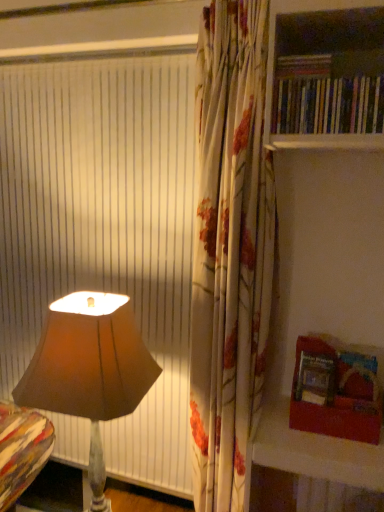
Question: From the image's perspective, is wooden bookshelf at right on hardcover book at upper right, acting as the second book starting from the bottom?

Choices:
 (A) no
 (B) yes

Answer: (A)

Question: From a real-world perspective, is wooden bookshelf at right below hardcover book at upper right, acting as the second book starting from the bottom?

Choices:
 (A) no
 (B) yes

Answer: (B)

Question: Is wooden bookshelf at right positioned behind hardcover book at upper right, which ranks as the first book in top-to-bottom order?

Choices:
 (A) no
 (B) yes

Answer: (A)

Question: Is wooden bookshelf at right positioned with its back to hardcover book at upper right, which ranks as the first book in top-to-bottom order?

Choices:
 (A) no
 (B) yes

Answer: (B)

Question: Does wooden bookshelf at right have a greater width compared to hardcover book at upper right, acting as the second book starting from the bottom?

Choices:
 (A) yes
 (B) no

Answer: (A)

Question: Does wooden bookshelf at right have a greater height compared to hardcover book at upper right, which ranks as the first book in top-to-bottom order?

Choices:
 (A) yes
 (B) no

Answer: (A)

Question: Is the depth of hardcover books at upper right, acting as the 2th book starting from the top, less than that of hardcover book at upper right, acting as the second book starting from the bottom?

Choices:
 (A) yes
 (B) no

Answer: (A)

Question: Is hardcover books at upper right, acting as the 2th book starting from the top, to the right of hardcover book at upper right, acting as the second book starting from the bottom, from the viewer's perspective?

Choices:
 (A) yes
 (B) no

Answer: (A)

Question: Is hardcover books at upper right, which ranks as the 1th book in bottom-to-top order, oriented away from hardcover book at upper right, acting as the second book starting from the bottom?

Choices:
 (A) no
 (B) yes

Answer: (A)

Question: Is hardcover book at upper right, which ranks as the first book in top-to-bottom order, a part of hardcover books at upper right, acting as the 2th book starting from the top?

Choices:
 (A) yes
 (B) no

Answer: (B)

Question: From a real-world perspective, does hardcover books at upper right, acting as the 2th book starting from the top, stand above hardcover book at upper right, which ranks as the first book in top-to-bottom order?

Choices:
 (A) no
 (B) yes

Answer: (A)

Question: Is hardcover books at upper right, acting as the 2th book starting from the top, smaller than hardcover book at upper right, which ranks as the first book in top-to-bottom order?

Choices:
 (A) yes
 (B) no

Answer: (B)

Question: From a real-world perspective, is wooden bookshelf at right below hardcover books at upper right, which ranks as the 1th book in bottom-to-top order?

Choices:
 (A) yes
 (B) no

Answer: (B)